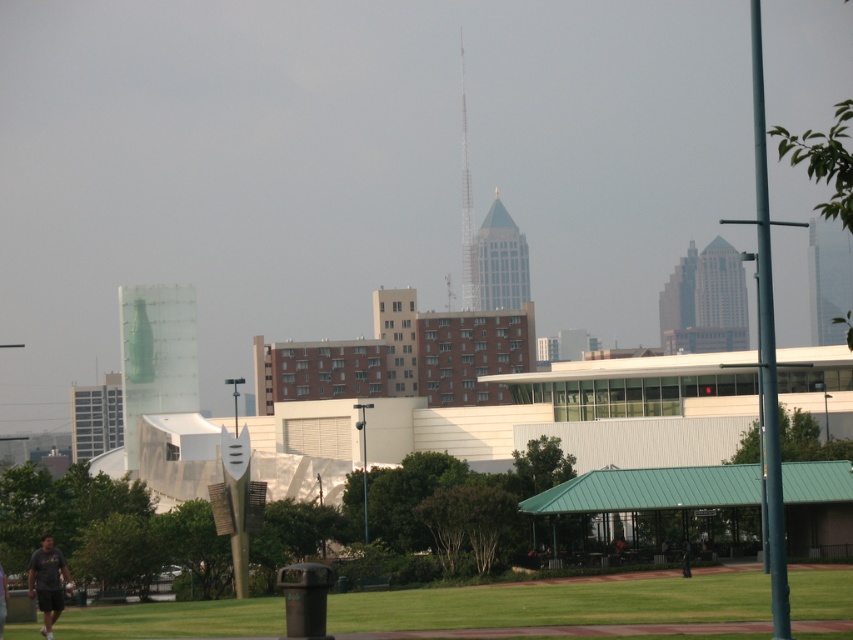
You are standing at the pavilion and want to walk towards the point marked at coordinates point (39, 563). Is there any obstruction between you and that point compared to the other point at point (686, 573)?

Point (39, 563) is in front of point (686, 573), so there is no obstruction between you and point (39, 563). However, the path to point (686, 573) may be blocked by the pavilion or other structures in the foreground.